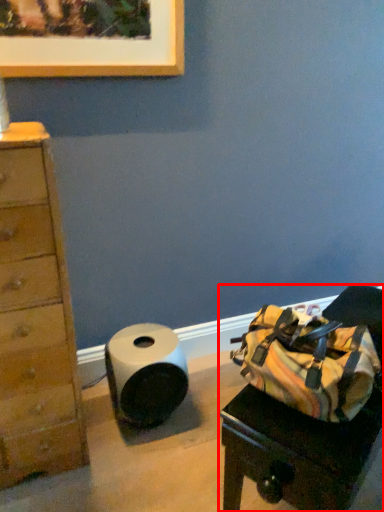
Question: Observing the image, what is the correct spatial positioning of furniture (annotated by the red box) in reference to paper towel?

Choices:
 (A) left
 (B) right

Answer: (B)